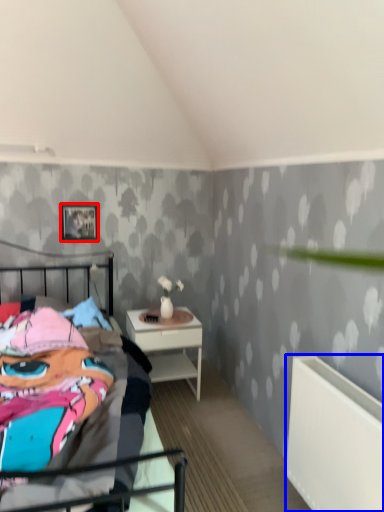
Question: Among these objects, which one is farthest to the camera, picture frame (highlighted by a red box) or radiator (highlighted by a blue box)?

Choices:
 (A) picture frame
 (B) radiator

Answer: (A)